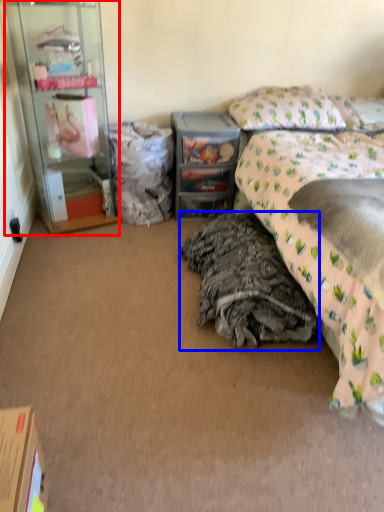
Question: Which of the following is the farthest to the observer, cabinetry (highlighted by a red box) or material (highlighted by a blue box)?

Choices:
 (A) cabinetry
 (B) material

Answer: (A)